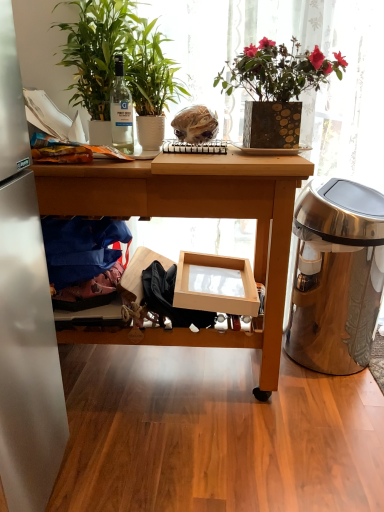
Question: Considering the relative positions of green matte plant at left, the second houseplant viewed from the right, and stainless steel trash can at right in the image provided, is green matte plant at left, the second houseplant viewed from the right, to the left or to the right of stainless steel trash can at right?

Choices:
 (A) right
 (B) left

Answer: (B)

Question: From a real-world perspective, is green matte plant at left, which ranks as the 1th houseplant in left-to-right order, above or below stainless steel trash can at right?

Choices:
 (A) below
 (B) above

Answer: (B)

Question: Based on their relative distances, which object is farther from the green matte plant at left, the second houseplant viewed from the right?

Choices:
 (A) white matte plate at center
 (B) clear glass bottle at upper left
 (C) stainless steel trash can at right
 (D) blue fabric at left
 (E) wooden desk at center

Answer: (C)

Question: Which is farther from the translucent plastic bag at center?

Choices:
 (A) white matte plate at center
 (B) green matte plant at left, the second houseplant viewed from the right
 (C) stainless steel trash can at right
 (D) green glossy plant at upper left, which is the second houseplant in left-to-right order
 (E) wooden desk at center

Answer: (C)